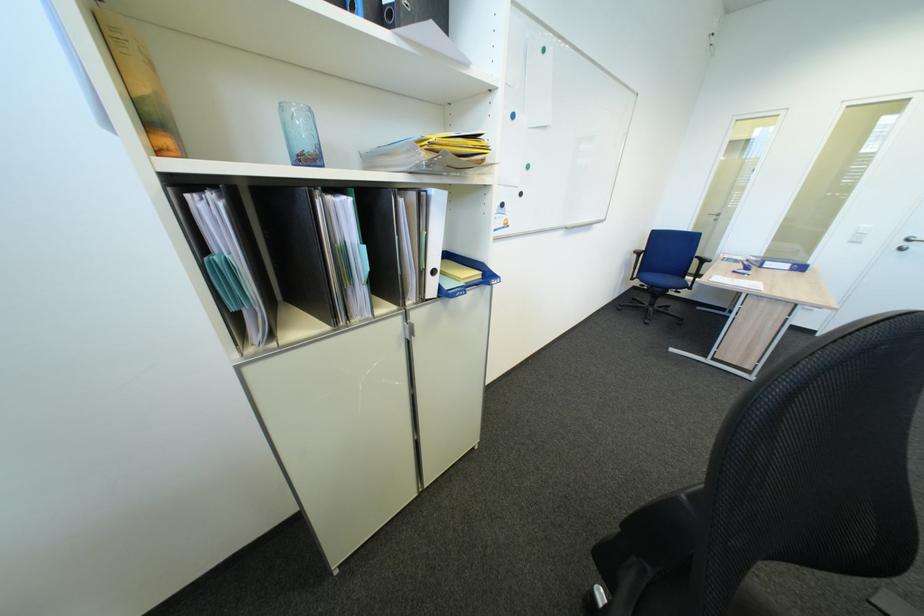
This screenshot has height=616, width=924. Identify the location of cabinet door handle. (714, 215).